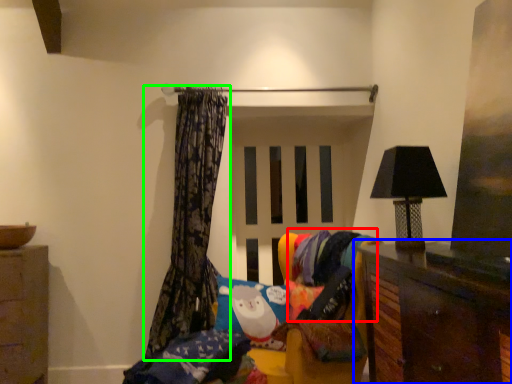
Question: Which is farther away from fabric (highlighted by a red box)? furniture (highlighted by a blue box) or curtain (highlighted by a green box)?

Choices:
 (A) furniture
 (B) curtain

Answer: (A)